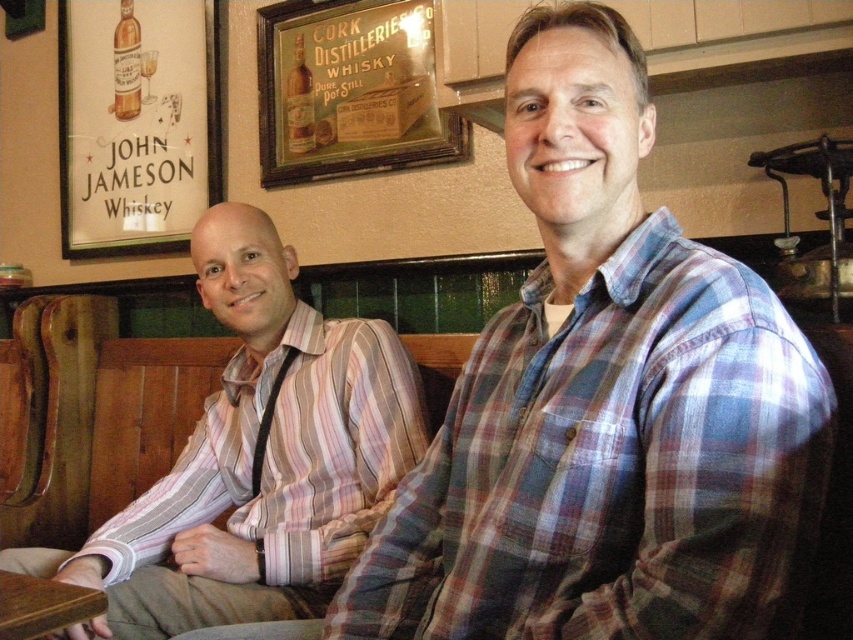
Based on the photo, two people are sitting at a bar. The first person is wearing a striped shirt with pink, white, and gray colors, and the second person is in a plaid shirt with blue, red, and white. They are seated side by side. If you were standing at the point marked at coordinates point (323,474), which person would be closer to you?

The person closer to the point (323,474) would depend on their positions relative to that point. Since the two individuals are 4.55 feet apart, the exact distance from each to the point is needed to determine proximity. Without additional spatial details, it cannot be conclusively determined which is closer.

You are a photographer standing in front of the bar scene. You need to focus your camera on the plaid cotton shirt at center. According to the coordinates provided, where exactly should you aim your camera?

The plaid cotton shirt at center is located at point (606, 404), so you should aim your camera at those coordinates to focus on it.

You are a photographer trying to capture a clear shot of both the plaid cotton shirt at center and the pink striped shirt at left. Since you can only focus on one subject at a time, which shirt should you focus on to ensure the other remains in the background?

You should focus on the plaid cotton shirt at center because it is in front of the pink striped shirt at left, so focusing on the front subject will keep the background subject in focus as well.